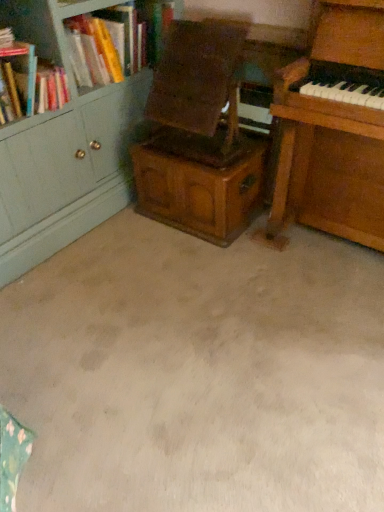
Question: Considering the relative sizes of wooden bookcase at upper left and wooden piano at right in the image provided, is wooden bookcase at upper left shorter than wooden piano at right?

Choices:
 (A) no
 (B) yes

Answer: (B)

Question: Is wooden piano at right completely or partially inside wooden bookcase at upper left?

Choices:
 (A) yes
 (B) no

Answer: (B)

Question: Is wooden bookcase at upper left looking in the opposite direction of wooden piano at right?

Choices:
 (A) no
 (B) yes

Answer: (A)

Question: Does wooden bookcase at upper left lie in front of wooden piano at right?

Choices:
 (A) yes
 (B) no

Answer: (B)

Question: Does wooden bookcase at upper left turn towards wooden piano at right?

Choices:
 (A) yes
 (B) no

Answer: (A)

Question: From a real-world perspective, is wooden bookcase at upper left beneath wooden piano at right?

Choices:
 (A) yes
 (B) no

Answer: (B)

Question: Is wooden piano at right closer to the viewer compared to wooden armchair at center?

Choices:
 (A) no
 (B) yes

Answer: (B)

Question: From the image's perspective, does wooden piano at right appear lower than wooden armchair at center?

Choices:
 (A) yes
 (B) no

Answer: (A)

Question: From a real-world perspective, is wooden piano at right over wooden armchair at center?

Choices:
 (A) yes
 (B) no

Answer: (B)

Question: Is wooden piano at right turned away from wooden armchair at center?

Choices:
 (A) yes
 (B) no

Answer: (B)

Question: Does wooden piano at right have a larger size compared to wooden armchair at center?

Choices:
 (A) yes
 (B) no

Answer: (A)

Question: Is wooden piano at right smaller than wooden armchair at center?

Choices:
 (A) no
 (B) yes

Answer: (A)

Question: From a real-world perspective, is hardcover book at upper left over wooden bookcase at upper left?

Choices:
 (A) no
 (B) yes

Answer: (B)